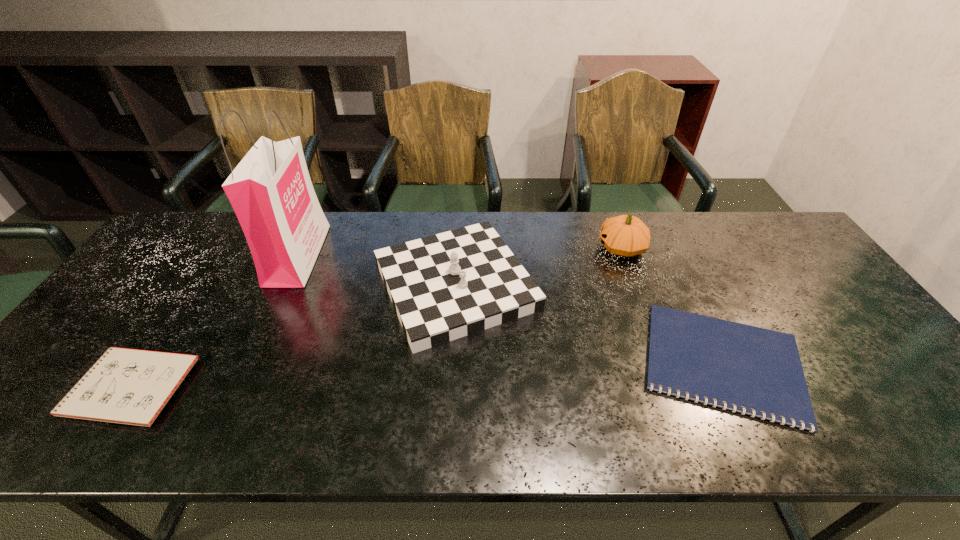
Identify the location of free spot between the third object from left to right and the gourd. The width and height of the screenshot is (960, 540). (539, 266).

Locate an element on the screen. The width and height of the screenshot is (960, 540). object that is the third closest to the shorter notepad is located at coordinates (270, 190).

Locate which object ranks in proximity to the third object from left to right. Please provide its 2D coordinates. Your answer should be formatted as a tuple, i.e. [(x, y)], where the tuple contains the x and y coordinates of a point satisfying the conditions above.

[(270, 190)]

This screenshot has width=960, height=540. Find the location of `free spot that satisfies the following two spatial constraints: 1. on the back side of the left notepad; 2. on the right side of the checkerboard`. free spot that satisfies the following two spatial constraints: 1. on the back side of the left notepad; 2. on the right side of the checkerboard is located at coordinates (198, 285).

Find the location of a particular element. This screenshot has height=540, width=960. free region that satisfies the following two spatial constraints: 1. on the side of the gourd with the carved face; 2. on the back side of the shortest object is located at coordinates 664,363.